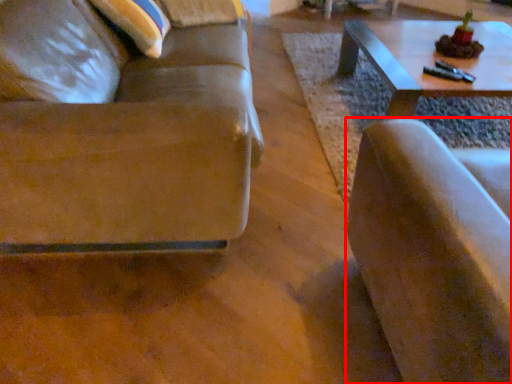
Question: From the image's perspective, where is chair (annotated by the red box) located in relation to studio couch in the image?

Choices:
 (A) above
 (B) below

Answer: (B)